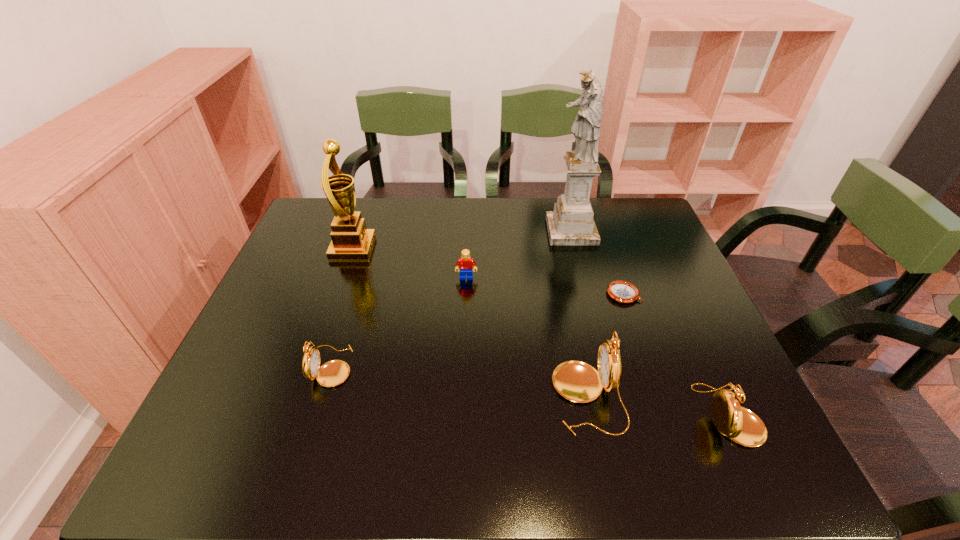
Locate an element on the screen. the leftmost pocket watch is located at coordinates (335, 372).

This screenshot has height=540, width=960. What are the coordinates of `the second pocket watch from left to right` in the screenshot? It's located at (577, 381).

Locate an element on the screen. The height and width of the screenshot is (540, 960). the third tallest object is located at coordinates (577, 381).

Where is `the second tallest pocket watch`? The width and height of the screenshot is (960, 540). the second tallest pocket watch is located at coordinates (741, 425).

Where is `the fourth tallest object`? This screenshot has width=960, height=540. the fourth tallest object is located at coordinates 741,425.

This screenshot has width=960, height=540. Identify the location of sculpture. (571, 223).

Locate an element on the screen. the second tallest object is located at coordinates (351, 240).

In order to click on the fifth object from right to left in this screenshot , I will do `click(465, 264)`.

The image size is (960, 540). In order to click on Lego in this screenshot , I will do (465, 264).

Where is `compass`? This screenshot has height=540, width=960. compass is located at coordinates (620, 291).